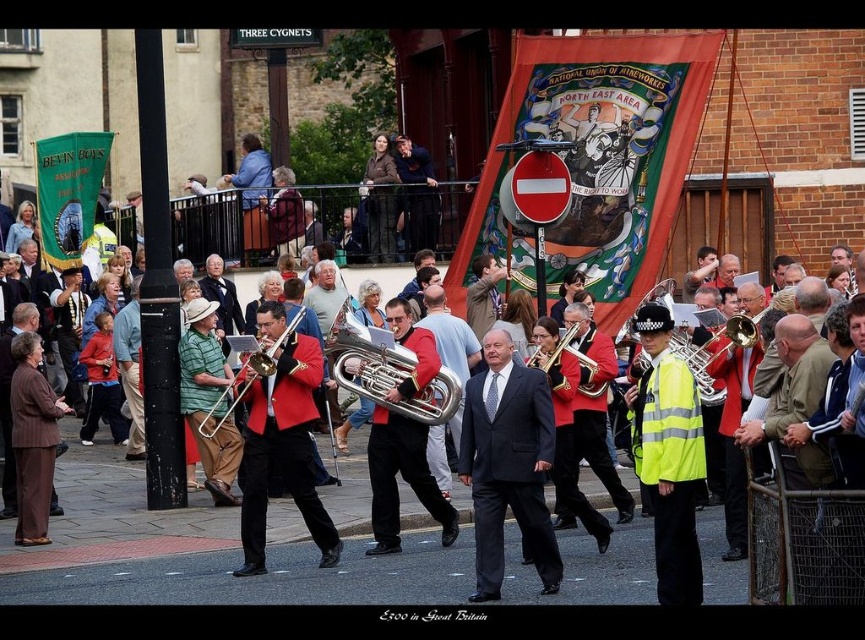
You are a photographer trying to capture the entire scene in one shot. The dark gray suit at center and the brass shiny trumpet at center are both in your frame. Which object should you focus on first to ensure both are in focus, considering their sizes?

The dark gray suit at center is smaller than the brass shiny trumpet at center, so you should focus on the brass shiny trumpet at center first since larger objects often require more precise focusing to ensure sharpness for both subjects.

You are a photographer trying to capture the entire scene in one shot. You notice the dark gray suit at center and the brass shiny trumpet at center. Which object should you focus on first to ensure both are in frame?

You should focus on the brass shiny trumpet at center first because it is wider than the dark gray suit at center, so positioning the camera to include the wider object ensures both will fit in the frame.